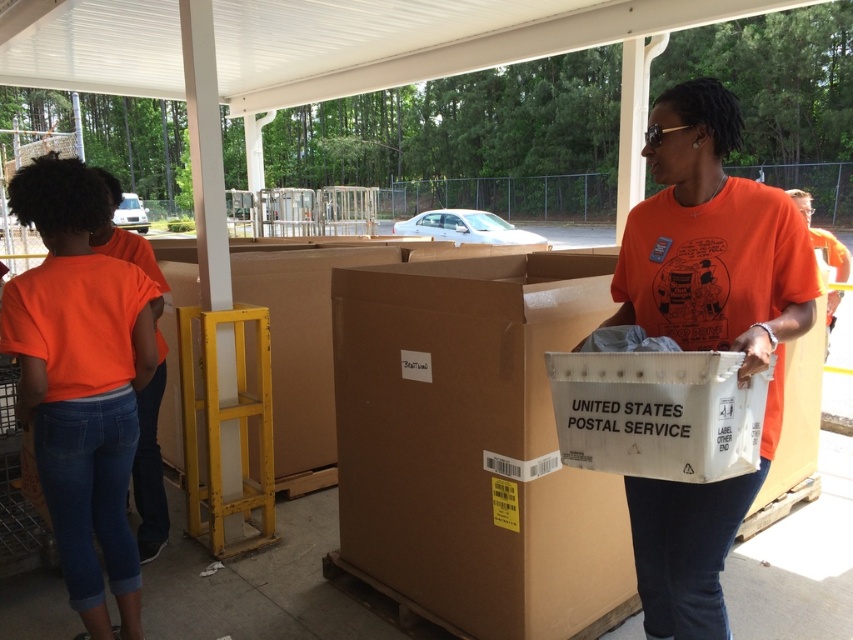
You are standing in the pavilion and need to place a sticker on the orange cotton shirt at left and the white cardboard box at center. According to their positions, which object is closer to the ground?

The orange cotton shirt at left is below the white cardboard box at center, so the orange cotton shirt at left is closer to the ground.

You are a photographer standing at the back of the pavilion. You need to take a photo of both the orange cotton shirt at left and the white cardboard box at center. Can you see both objects fully in your photo without any obstruction?

The orange cotton shirt at left is much taller than the white cardboard box at center, so the shirt may block the view of the box if they are positioned in a way that the shirt is in front of the box. However, since the photographer is at the back, adjusting the angle or position might allow capturing both without obstruction.